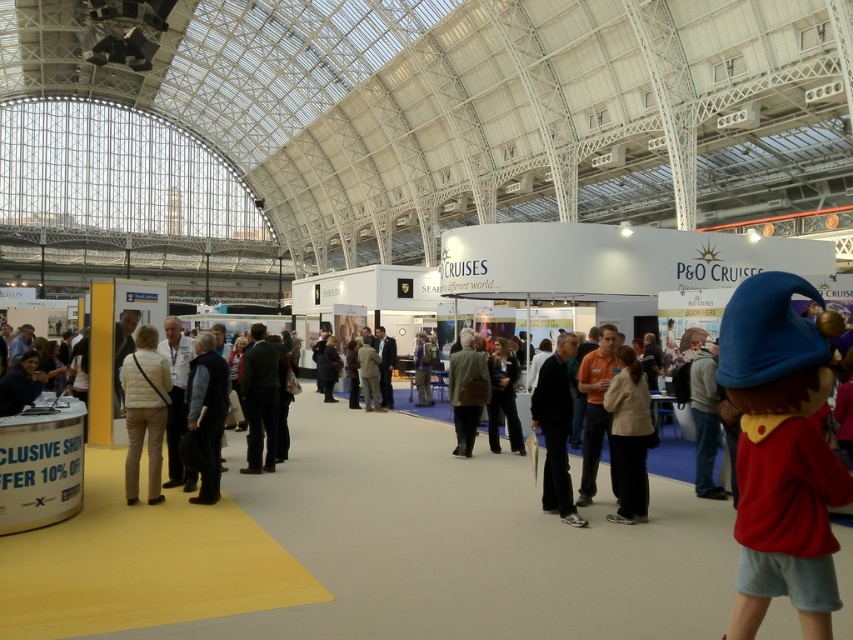
Does orange shirt at center have a greater height compared to dark blue suit at center?

Yes, orange shirt at center is taller than dark blue suit at center.

Does orange shirt at center appear over dark blue suit at center?

Yes.

Is point (601, 344) positioned before point (378, 348)?

Yes, it is.

Identify the location of orange shirt at center. (596, 410).

Based on the photo, between dark gray sweater at center and dark blue suit at center, which one appears on the left side from the viewer's perspective?

From the viewer's perspective, dark gray sweater at center appears more on the left side.

How much distance is there between dark gray sweater at center and dark blue suit at center?

dark gray sweater at center and dark blue suit at center are 37.87 feet apart from each other.

Is point (196, 435) closer to viewer compared to point (381, 372)?

Yes, it is in front of point (381, 372).

Where is `dark gray sweater at center`? dark gray sweater at center is located at coordinates (207, 412).

Is black fabric pants at center further to the viewer compared to dark gray sweater at center?

That is False.

The height and width of the screenshot is (640, 853). Identify the location of black fabric pants at center. (556, 429).